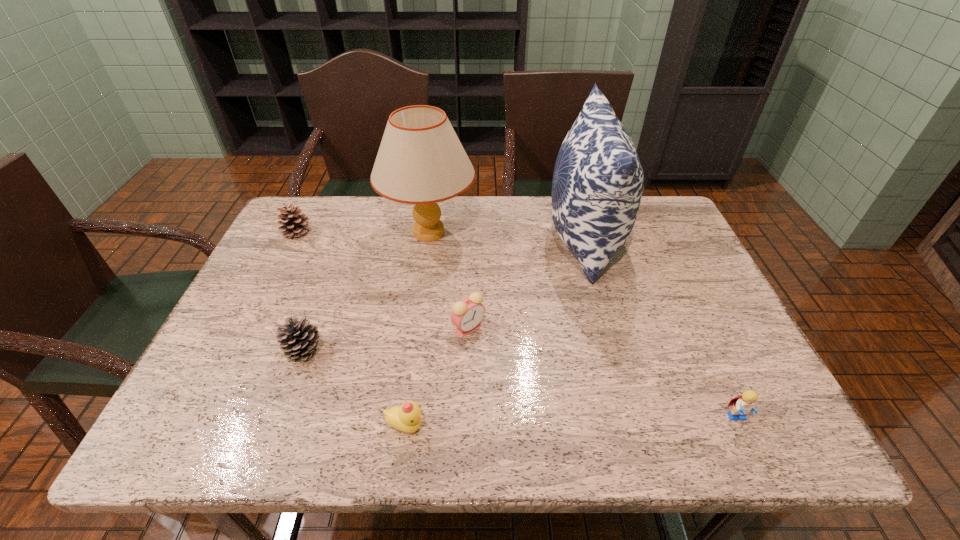
Identify the location of empty location between the Lego and the left pinecone. (516, 325).

Identify the location of vacant point located between the duckling and the cushion. This screenshot has height=540, width=960. coord(495,333).

Locate an element on the screen. free space between the rightmost object and the nearer pinecone is located at coordinates (520, 384).

This screenshot has height=540, width=960. I want to click on vacant space that's between the right pinecone and the lampshade, so click(367, 291).

You are a GUI agent. You are given a task and a screenshot of the screen. Output one action in this format:
    pyautogui.click(x=<x>, y=<y>)
    Task: Click on the vacant area that lies between the right pinecone and the cushion
    This screenshot has width=960, height=540.
    Given the screenshot: What is the action you would take?
    pyautogui.click(x=444, y=294)

Identify the location of unoccupied area between the rightmost object and the cushion. This screenshot has width=960, height=540. (660, 328).

This screenshot has width=960, height=540. Identify the location of vacant area that lies between the nearer pinecone and the left pinecone. (300, 291).

Identify the location of free spot between the alarm clock and the lampshade. (448, 280).

At what (x,y) coordinates should I click in order to perform the action: click on free space between the cushion and the duckling. Please return your answer as a coordinate pair (x, y). Looking at the image, I should click on (495, 333).

Find the location of a particular element. object that is the second closest to the rightmost object is located at coordinates (467, 314).